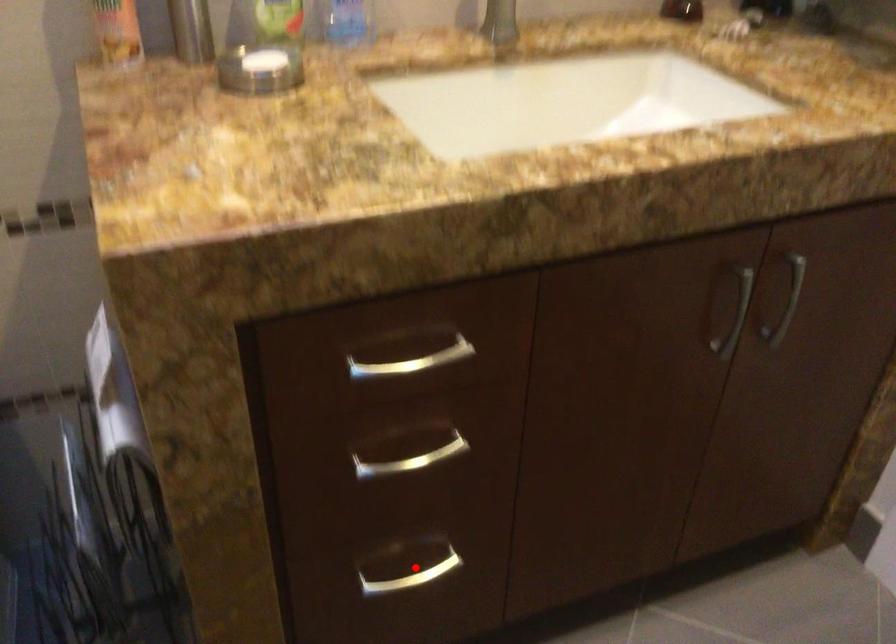
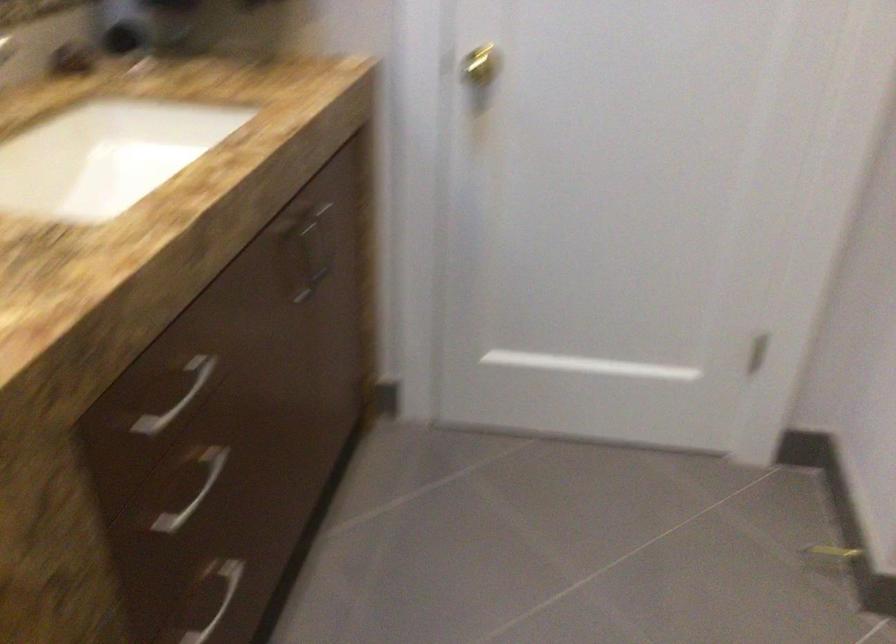
Where in the second image is the point corresponding to the highlighted location from the first image?

(211, 600)